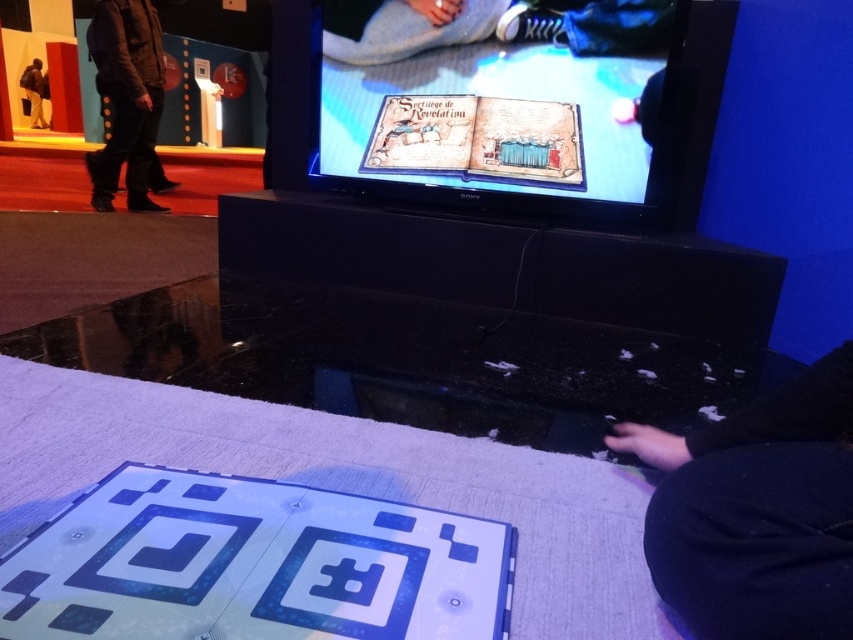
Is black fabric pants at lower right further to camera compared to brown leather jacket at upper left?

No, black fabric pants at lower right is closer to the viewer.

Does black fabric pants at lower right have a greater width compared to brown leather jacket at upper left?

No.

Who is more forward, [791,390] or [28,124]?

Positioned in front is point [791,390].

Where is `black fabric pants at lower right`? The width and height of the screenshot is (853, 640). black fabric pants at lower right is located at coordinates (757, 512).

Can you confirm if black suede boots at left is smaller than brown leather jacket at upper left?

No.

Is point (120, 81) positioned before point (21, 76)?

Yes, point (120, 81) is closer to viewer.

This screenshot has width=853, height=640. Find the location of `black suede boots at left`. black suede boots at left is located at coordinates (126, 97).

Based on the photo, can you confirm if black fabric pants at lower right is positioned above black suede boots at left?

No.

Is black fabric pants at lower right further to camera compared to black suede boots at left?

No, it is not.

Is point (747, 496) more distant than point (114, 156)?

No.

Where is `black fabric pants at lower right`? The height and width of the screenshot is (640, 853). black fabric pants at lower right is located at coordinates pos(757,512).